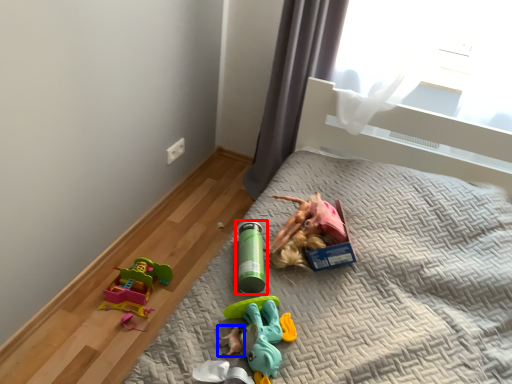
Question: Among these objects, which one is farthest to the camera, toy (highlighted by a red box) or toy (highlighted by a blue box)?

Choices:
 (A) toy
 (B) toy

Answer: (A)